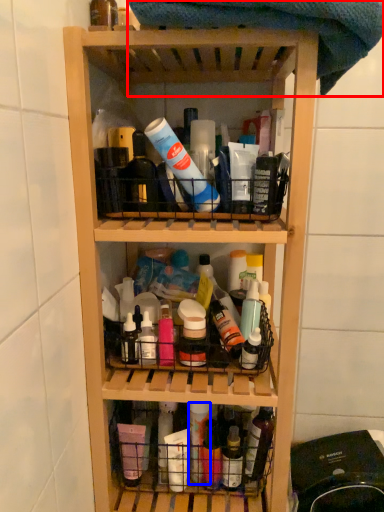
Question: Which object appears closest to the camera in this image, beach towel (highlighted by a red box) or bottle (highlighted by a blue box)?

Choices:
 (A) beach towel
 (B) bottle

Answer: (A)